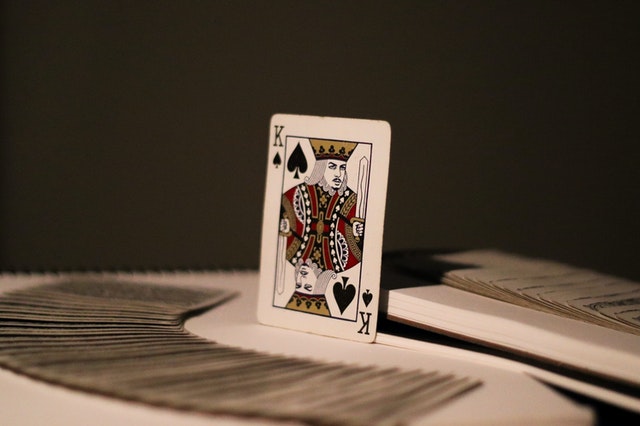
This screenshot has height=426, width=640. What are the coordinates of `dark area below table` in the screenshot? It's located at (619, 416).